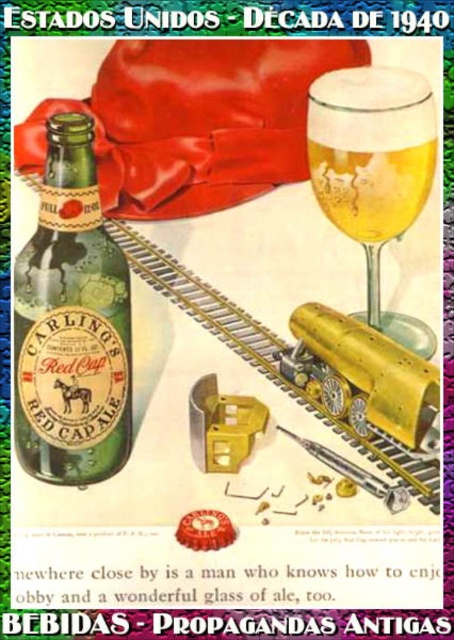
In the vintage Carling advertisement, there is a green glass bottle at left and a translucent glass champagne at upper right. Which object is positioned to the left of the other?

The green glass bottle at left is positioned to the left of the translucent glass champagne at upper right.

You are a barista in a 1940s diner. You need to pour a drink into the green glass bottle at left and the translucent glass beer at upper right. Which container can hold more liquid based on their sizes?

The translucent glass beer at upper right can hold more liquid since it is larger than the green glass bottle at left.